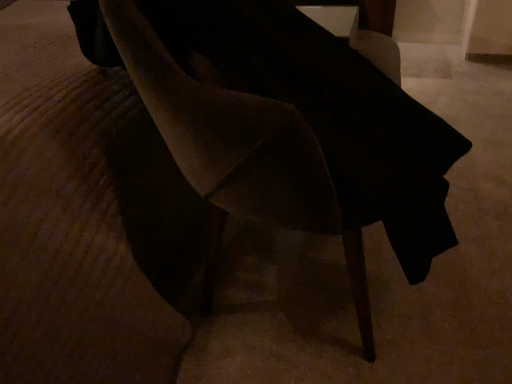
Describe the element at coordinates (291, 127) in the screenshot. I see `suede-like brown chair at center` at that location.

You are a GUI agent. You are given a task and a screenshot of the screen. Output one action in this format:
    pyautogui.click(x=<x>, y=<y>)
    Task: Click on the suede-like brown chair at center
    The height and width of the screenshot is (384, 512).
    Given the screenshot: What is the action you would take?
    pyautogui.click(x=291, y=127)

Image resolution: width=512 pixels, height=384 pixels. In order to click on suede-like brown chair at center in this screenshot , I will do `click(291, 127)`.